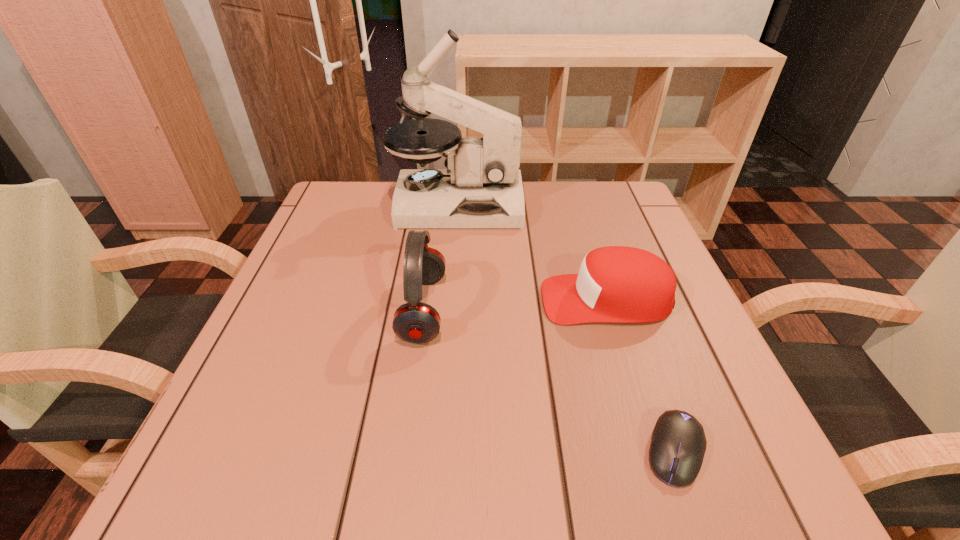
Where is `vacant space at the near left corner of the desktop`? This screenshot has height=540, width=960. vacant space at the near left corner of the desktop is located at coordinates coord(276,488).

This screenshot has width=960, height=540. In the image, there is a desktop. What are the coordinates of `vacant space at the far right corner` in the screenshot? It's located at (612, 185).

Where is `free space at the near right corner`? free space at the near right corner is located at coordinates (715, 445).

What are the coordinates of `vacant space in between the shortest object and the microscope` in the screenshot? It's located at (565, 328).

Image resolution: width=960 pixels, height=540 pixels. I want to click on unoccupied area between the second tallest object and the baseball cap, so click(515, 305).

Locate an element on the screen. This screenshot has width=960, height=540. blank region between the baseball cap and the farthest object is located at coordinates (532, 252).

Locate an element on the screen. The height and width of the screenshot is (540, 960). free space between the tallest object and the computer mouse is located at coordinates (565, 328).

Find the location of a particular element. Image resolution: width=960 pixels, height=540 pixels. vacant space that's between the computer mouse and the third shortest object is located at coordinates (549, 380).

Where is `free space between the baseball cap and the third shortest object`? The height and width of the screenshot is (540, 960). free space between the baseball cap and the third shortest object is located at coordinates (515, 305).

Identify which object is the third closest to the second tallest object. Please provide its 2D coordinates. Your answer should be formatted as a tuple, i.e. [(x, y)], where the tuple contains the x and y coordinates of a point satisfying the conditions above.

[(678, 445)]